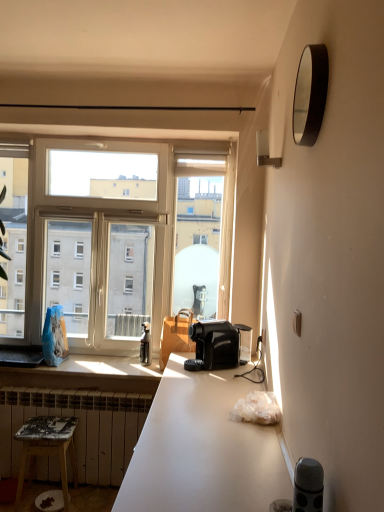
You are a GUI agent. You are given a task and a screenshot of the screen. Output one action in this format:
    pyautogui.click(x=<x>, y=<y>)
    Task: Click on the vacant space situated above wooden stool at lower left (from a real-world perspective)
    
    Given the screenshot: What is the action you would take?
    pyautogui.click(x=52, y=422)